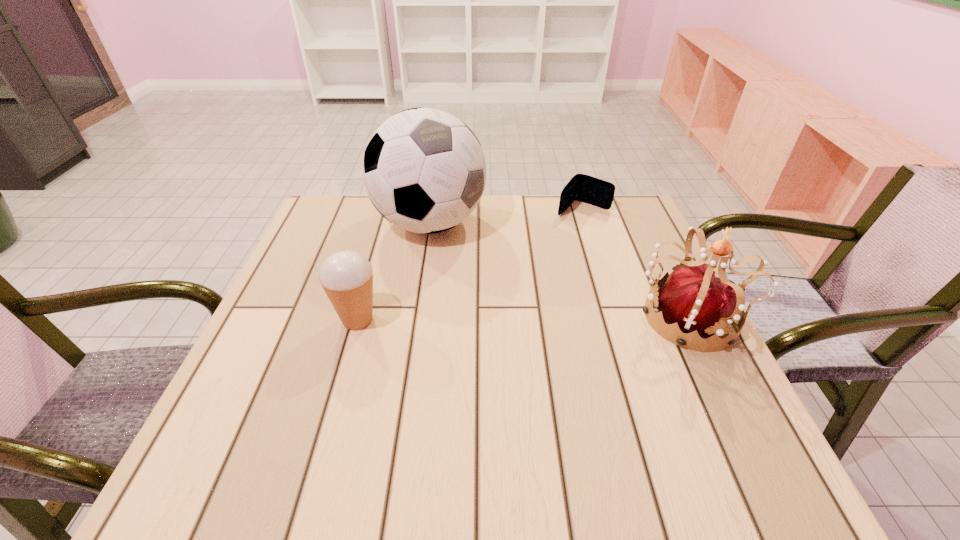
Locate an element on the screen. Image resolution: width=960 pixels, height=540 pixels. icecream is located at coordinates (347, 277).

Where is `tiara`? tiara is located at coordinates point(691,298).

Where is `the shortest object`? The height and width of the screenshot is (540, 960). the shortest object is located at coordinates (584, 188).

Image resolution: width=960 pixels, height=540 pixels. I want to click on the tallest object, so click(424, 170).

Where is `vacant space positioned on the back of the icecream`? The image size is (960, 540). vacant space positioned on the back of the icecream is located at coordinates (391, 205).

Where is `vacant area situated 0.210m on the outer surface of the shortest object`? This screenshot has width=960, height=540. vacant area situated 0.210m on the outer surface of the shortest object is located at coordinates (535, 256).

Image resolution: width=960 pixels, height=540 pixels. What are the coordinates of `vacant region located 0.290m on the outer surface of the shortest object` in the screenshot? It's located at (518, 274).

Where is `free space located 0.360m on the outer surface of the shortest object`? The height and width of the screenshot is (540, 960). free space located 0.360m on the outer surface of the shortest object is located at coordinates (503, 292).

Locate an element on the screen. This screenshot has width=960, height=540. blank area located on the main logo of the soccer ball is located at coordinates (468, 279).

You are a GUI agent. You are given a task and a screenshot of the screen. Output one action in this format:
    pyautogui.click(x=<x>, y=<y>)
    Task: Click on the vacant region located 0.350m on the main logo of the soccer ball
    This screenshot has width=960, height=540.
    Given the screenshot: What is the action you would take?
    pyautogui.click(x=522, y=356)